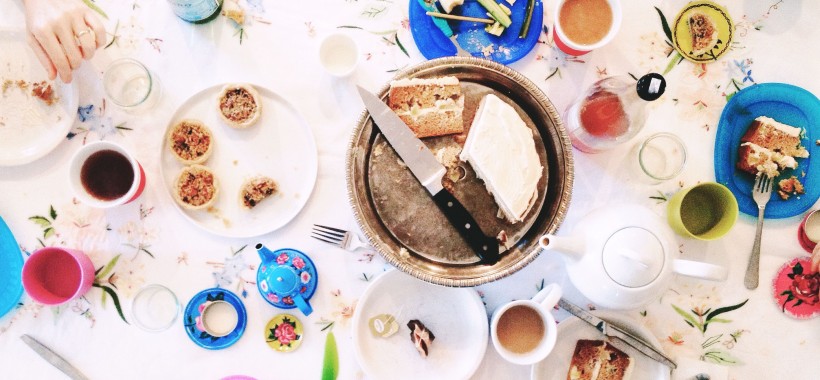
The height and width of the screenshot is (380, 820). I want to click on plate, so click(290, 166).